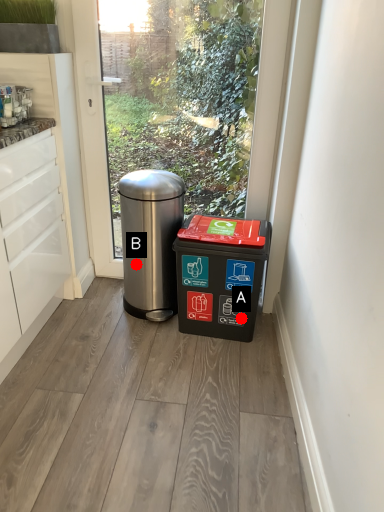
Question: Two points are circled on the image, labeled by A and B beside each circle. Among these points, which one is nearest to the camera?

Choices:
 (A) A is closer
 (B) B is closer

Answer: (A)